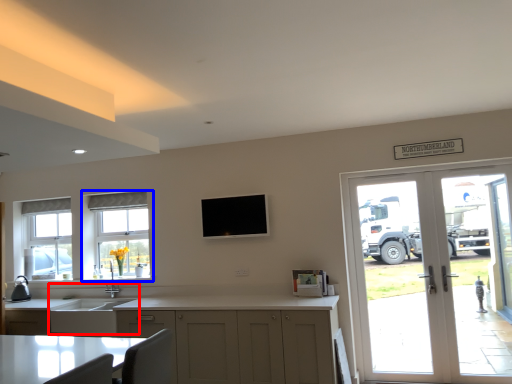
Question: Which object is further to the camera taking this photo, sink (highlighted by a red box) or window (highlighted by a blue box)?

Choices:
 (A) sink
 (B) window

Answer: (B)